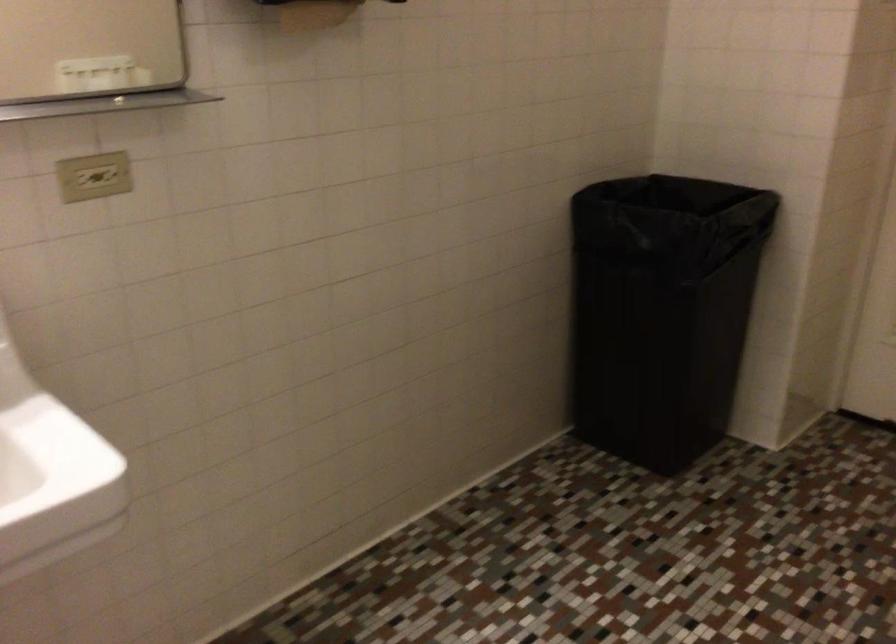
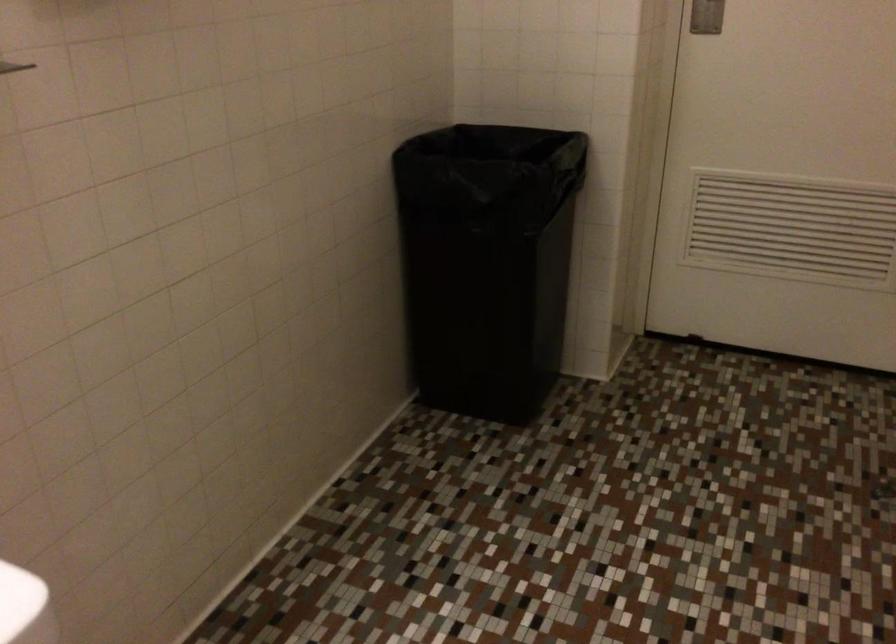
Question: The first image is from the beginning of the video and the second image is from the end. How did the camera likely rotate when shooting the video?

Choices:
 (A) Left
 (B) Right
 (C) Up
 (D) Down

Answer: (B)